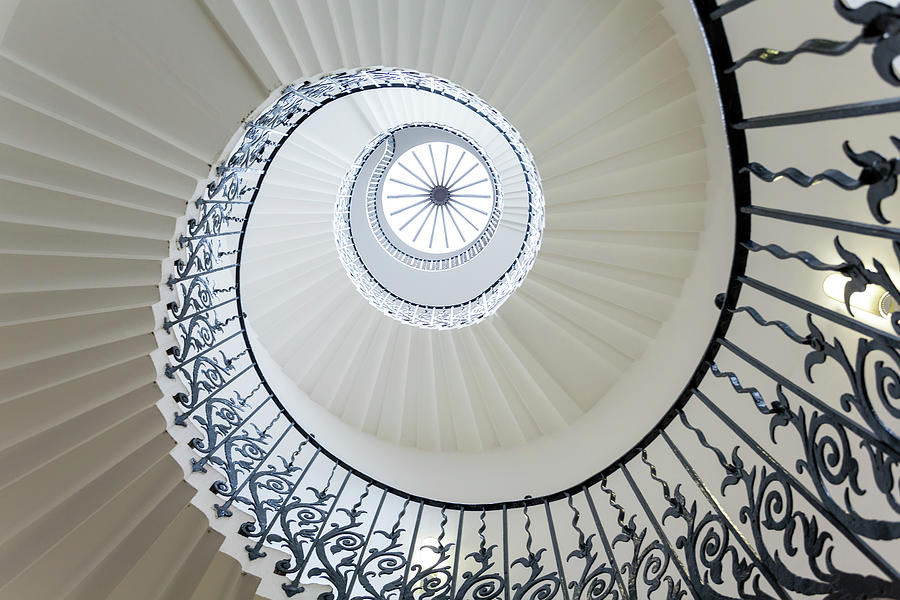
The image size is (900, 600). In order to click on white walls in this screenshot , I will do `click(613, 425)`, `click(316, 427)`.